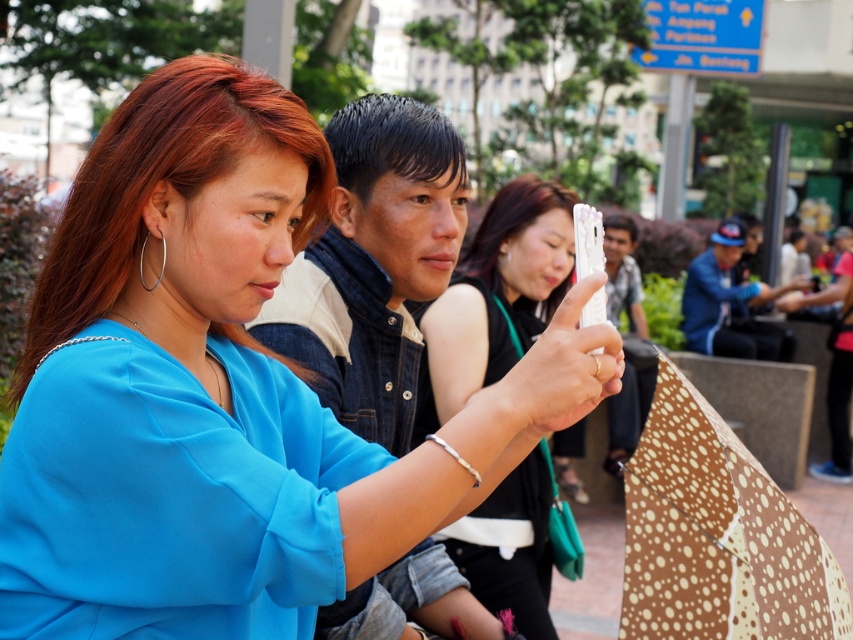
Who is taller, matte blue blouse at center or white matte phone at center?

white matte phone at center

Measure the distance between point (218, 147) and camera.

Point (218, 147) and camera are 5.66 feet apart.

Where is `matte blue blouse at center`? The image size is (853, 640). matte blue blouse at center is located at coordinates (219, 392).

This screenshot has height=640, width=853. What do you see at coordinates (717, 536) in the screenshot?
I see `brown dotted fabric umbrella at center` at bounding box center [717, 536].

Is brown dotted fabric umbrella at center shorter than white matte phone at center?

Indeed, brown dotted fabric umbrella at center has a lesser height compared to white matte phone at center.

Find the location of a particular element. This screenshot has height=640, width=853. brown dotted fabric umbrella at center is located at coordinates (717, 536).

Who is shorter, white matte phone at center or denim jacket at center?

With less height is white matte phone at center.

Consider the image. Who is higher up, white matte phone at center or denim jacket at center?

Positioned higher is denim jacket at center.

Image resolution: width=853 pixels, height=640 pixels. What do you see at coordinates (498, 291) in the screenshot?
I see `white matte phone at center` at bounding box center [498, 291].

Identify the location of white matte phone at center. This screenshot has height=640, width=853. (498, 291).